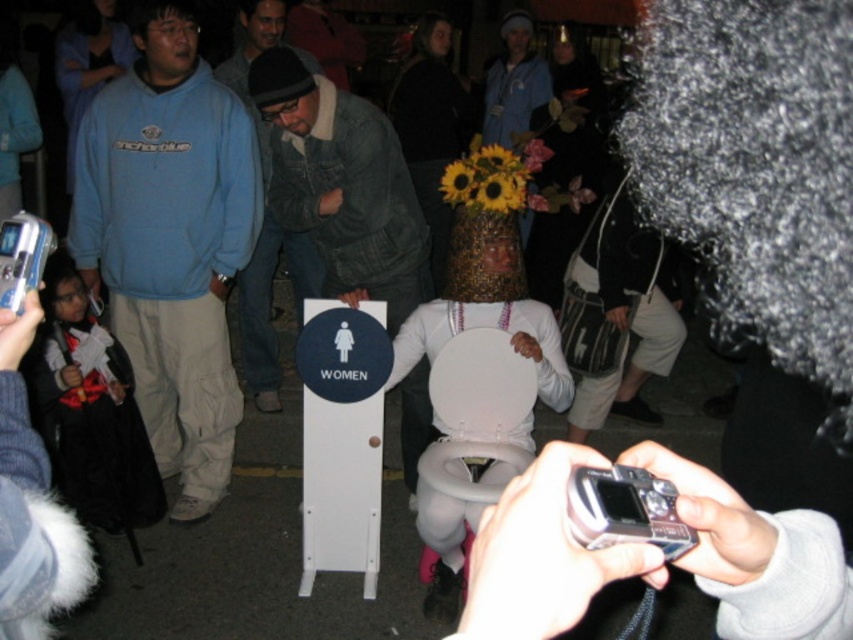
Question: Does denim jacket at center have a smaller size compared to denim jacket at left?

Choices:
 (A) no
 (B) yes

Answer: (A)

Question: Which of the following is the farthest from the observer?

Choices:
 (A) (276, 381)
 (B) (296, 92)
 (C) (155, 429)
 (D) (514, 346)

Answer: (A)

Question: Which object is the farthest from the white plastic toilet at center?

Choices:
 (A) blue fleece sweatshirt at left
 (B) denim jacket at left
 (C) denim jacket at center

Answer: (B)

Question: From the image, what is the correct spatial relationship of blue fleece sweatshirt at left in relation to denim jacket at center?

Choices:
 (A) right
 (B) left

Answer: (B)

Question: Among these objects, which one is nearest to the camera?

Choices:
 (A) white plastic toilet at center
 (B) denim jacket at left
 (C) blue fleece sweatshirt at left

Answer: (A)

Question: Does white plastic toilet at center have a lesser width compared to denim jacket at left?

Choices:
 (A) no
 (B) yes

Answer: (A)